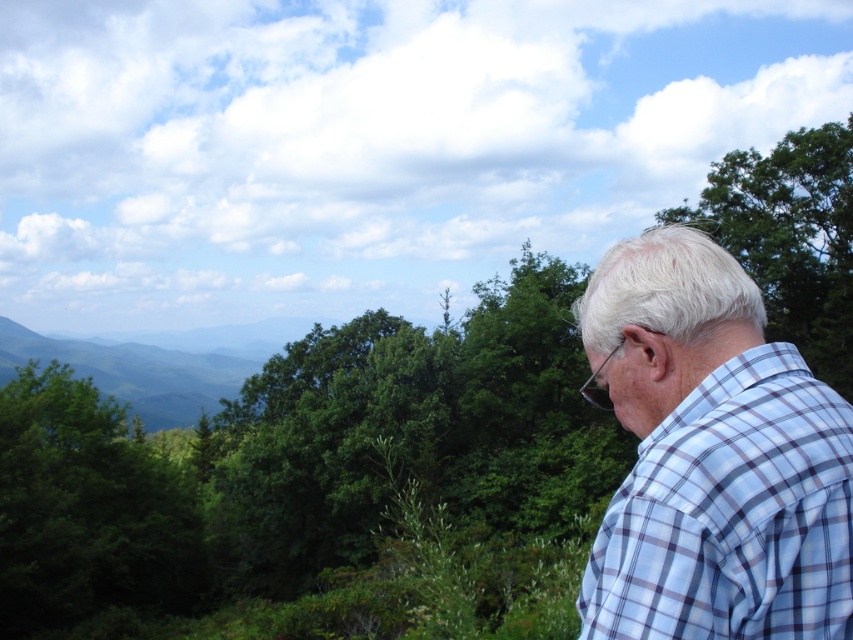
Does point (688, 326) lie in front of point (851, 234)?

Yes, it is.

In the scene shown: Which is more to the right, light blue plaid shirt at right or green leafy tree at upper right?

green leafy tree at upper right

Is point (747, 323) closer to viewer compared to point (838, 237)?

Yes, point (747, 323) is in front of point (838, 237).

Locate an element on the screen. This screenshot has height=640, width=853. light blue plaid shirt at right is located at coordinates (712, 456).

Can you confirm if green leafy tree at left is thinner than green leafy tree at upper right?

In fact, green leafy tree at left might be wider than green leafy tree at upper right.

How much distance is there between green leafy tree at left and green leafy tree at upper right?

green leafy tree at left is 22.05 meters away from green leafy tree at upper right.

This screenshot has height=640, width=853. I want to click on green leafy tree at left, so click(x=86, y=508).

Which is more to the left, light blue plaid shirt at right or green leafy tree at left?

From the viewer's perspective, green leafy tree at left appears more on the left side.

How far apart are light blue plaid shirt at right and green leafy tree at left?

18.22 meters

The image size is (853, 640). Describe the element at coordinates (712, 456) in the screenshot. I see `light blue plaid shirt at right` at that location.

Find the location of `light blue plaid shirt at right`. light blue plaid shirt at right is located at coordinates (712, 456).